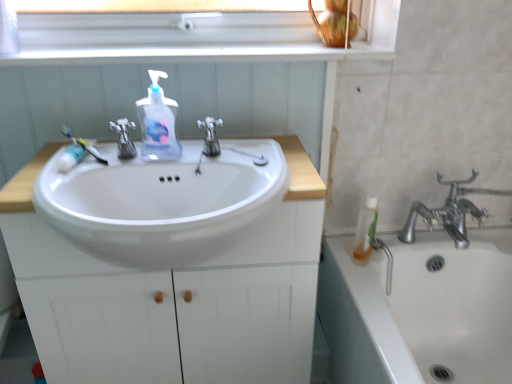
Find the location of a particular element. free location to the right of silver metallic faucet at center, which ranks as the second tap in left-to-right order is located at coordinates (276, 167).